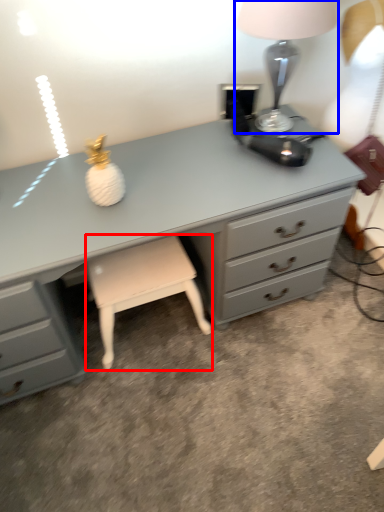
Question: Among these objects, which one is nearest to the camera, stool (highlighted by a red box) or table lamp (highlighted by a blue box)?

Choices:
 (A) stool
 (B) table lamp

Answer: (B)